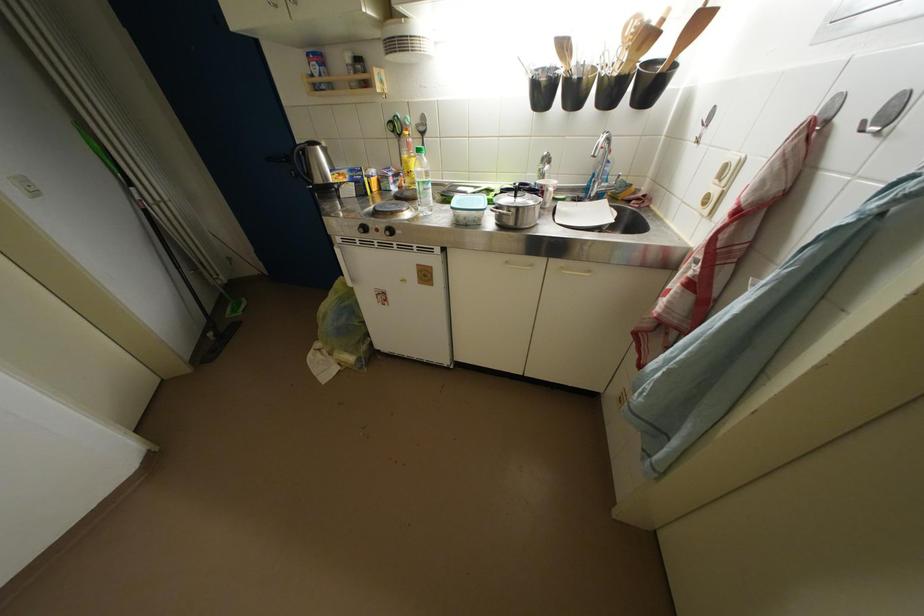
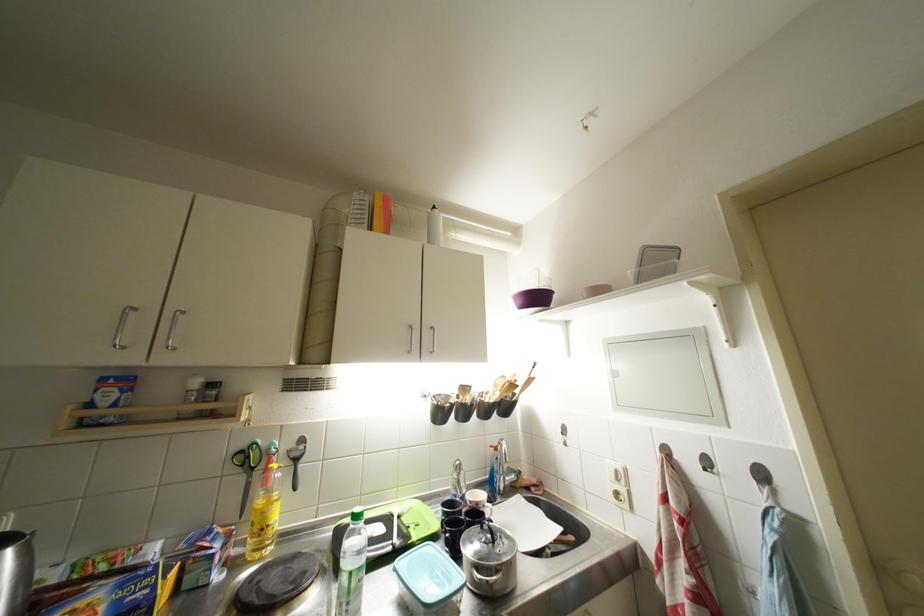
The point at (896, 119) is marked in the first image. Where is the corresponding point in the second image?

(714, 467)